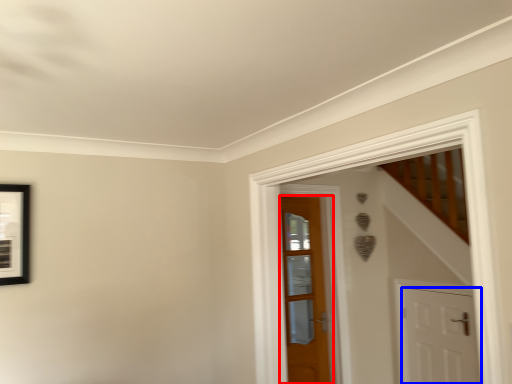
Question: Among these objects, which one is farthest to the camera, door (highlighted by a red box) or door (highlighted by a blue box)?

Choices:
 (A) door
 (B) door

Answer: (A)